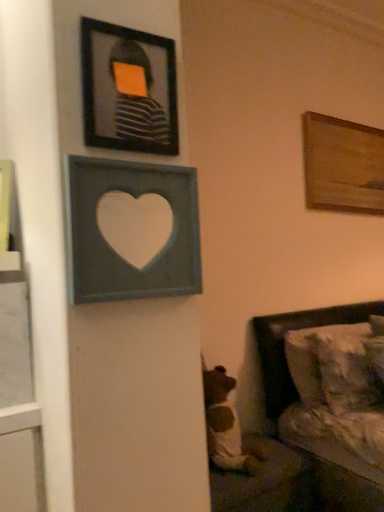
Question: Does gray wood heart at upper center, placed as the 2th picture frame when sorted from right to left, turn towards brown plush bear at lower center?

Choices:
 (A) no
 (B) yes

Answer: (A)

Question: From a real-world perspective, is gray wood heart at upper center, the third picture frame from the back, physically below brown plush bear at lower center?

Choices:
 (A) yes
 (B) no

Answer: (B)

Question: From a real-world perspective, is gray wood heart at upper center, placed as the 2th picture frame when sorted from right to left, on brown plush bear at lower center?

Choices:
 (A) no
 (B) yes

Answer: (B)

Question: Is gray wood heart at upper center, which appears as the first picture frame when viewed from the front, positioned behind brown plush bear at lower center?

Choices:
 (A) yes
 (B) no

Answer: (B)

Question: Is gray wood heart at upper center, the second picture frame viewed from the left, in front of brown plush bear at lower center?

Choices:
 (A) yes
 (B) no

Answer: (A)

Question: Does point (87, 100) appear closer or farther from the camera than point (296, 335)?

Choices:
 (A) closer
 (B) farther

Answer: (A)

Question: From a real-world perspective, is matte black frame at upper left, which is counted as the 3th picture frame, starting from the right, above or below white textured pillow at lower right?

Choices:
 (A) above
 (B) below

Answer: (A)

Question: From their relative heights in the image, would you say matte black frame at upper left, acting as the second picture frame starting from the back, is taller or shorter than white textured pillow at lower right?

Choices:
 (A) short
 (B) tall

Answer: (A)

Question: Is matte black frame at upper left, arranged as the first picture frame when viewed from the left, in front of or behind white textured pillow at lower right in the image?

Choices:
 (A) front
 (B) behind

Answer: (A)

Question: Is matte black frame at upper left, acting as the second picture frame starting from the back, bigger or smaller than brown plush bear at lower center?

Choices:
 (A) small
 (B) big

Answer: (A)

Question: Is matte black frame at upper left, which is counted as the 3th picture frame, starting from the right, in front of or behind brown plush bear at lower center in the image?

Choices:
 (A) front
 (B) behind

Answer: (A)

Question: Would you say matte black frame at upper left, which is counted as the 3th picture frame, starting from the right, is inside or outside brown plush bear at lower center?

Choices:
 (A) inside
 (B) outside

Answer: (B)

Question: Considering the positions of matte black frame at upper left, arranged as the first picture frame when viewed from the left, and brown plush bear at lower center in the image, is matte black frame at upper left, arranged as the first picture frame when viewed from the left, taller or shorter than brown plush bear at lower center?

Choices:
 (A) tall
 (B) short

Answer: (B)

Question: Considering their positions, is wooden painting at upper right, the 1th picture frame viewed from the back, located in front of or behind white textured pillow at lower right?

Choices:
 (A) front
 (B) behind

Answer: (B)

Question: Would you say wooden painting at upper right, which is counted as the 3th picture frame, starting from the front, is inside or outside white textured pillow at lower right?

Choices:
 (A) outside
 (B) inside

Answer: (A)